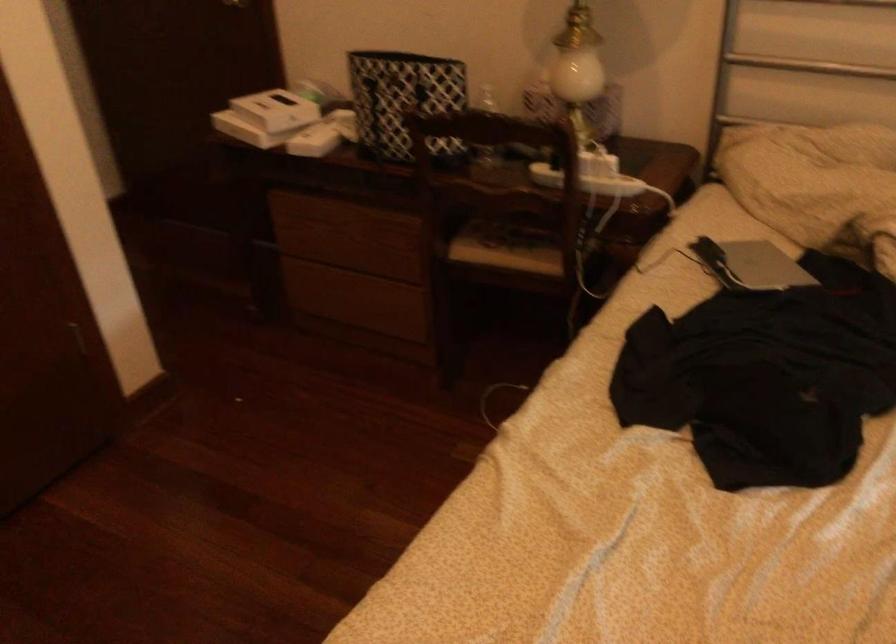
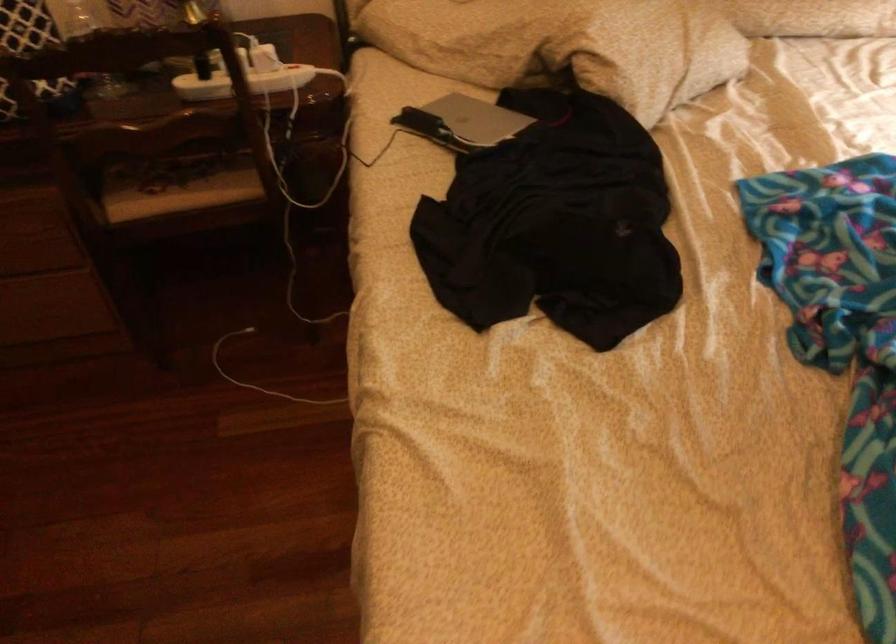
In the second image, find the point that corresponds to pixel 572 178 in the first image.

(243, 82)